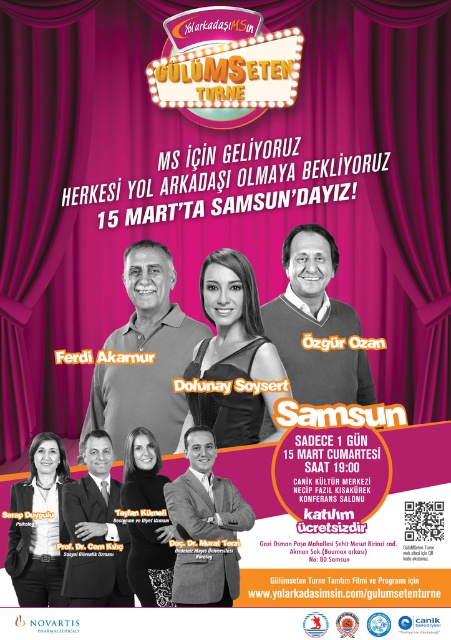
Question: Which object appears farthest from the camera in this image?

Choices:
 (A) dark brown suit jacket at center
 (B) matte black jacket at center

Answer: (B)

Question: Which point appears farthest from the camera in this image?

Choices:
 (A) (162, 368)
 (B) (244, 417)
 (C) (294, 380)
 (D) (164, 540)

Answer: (A)

Question: Which object appears farthest from the camera in this image?

Choices:
 (A) black textured dress at center
 (B) dark brown suit at center
 (C) matte black shirt at center

Answer: (C)

Question: Is matte black jacket at center further to the viewer compared to black textured dress at center?

Choices:
 (A) yes
 (B) no

Answer: (A)

Question: Where is dark brown suit jacket at center located in relation to black textured dress at center in the image?

Choices:
 (A) left
 (B) right

Answer: (B)

Question: Does matte black hair at center have a smaller size compared to dark brown suit at center?

Choices:
 (A) yes
 (B) no

Answer: (B)